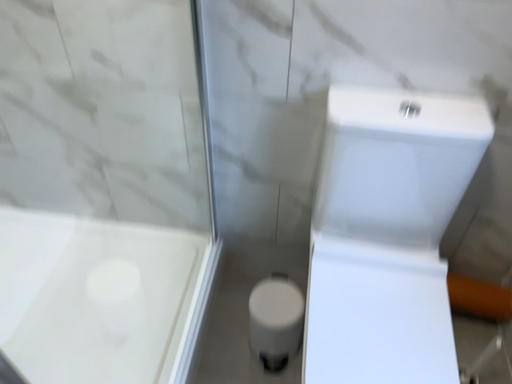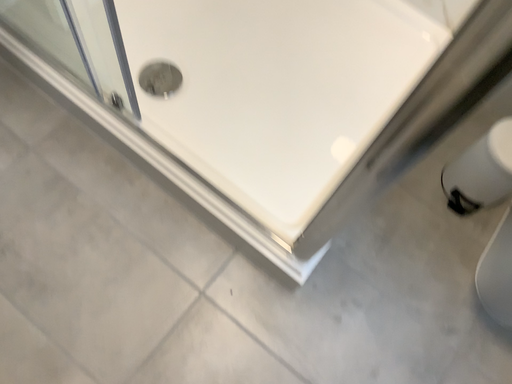
Question: Which way did the camera rotate in the video?

Choices:
 (A) rotated downward
 (B) rotated upward

Answer: (A)